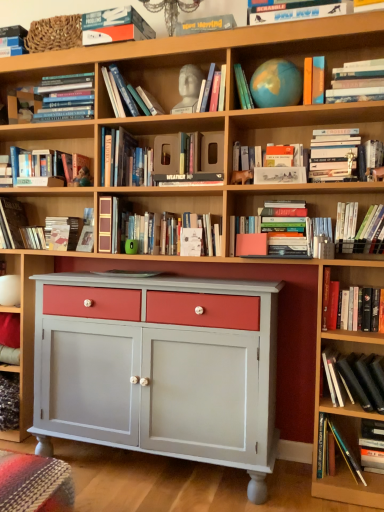
I want to click on free location above hardcover book at left, which is the 6th book in bottom-to-top order (from a real-world perspective), so click(14, 192).